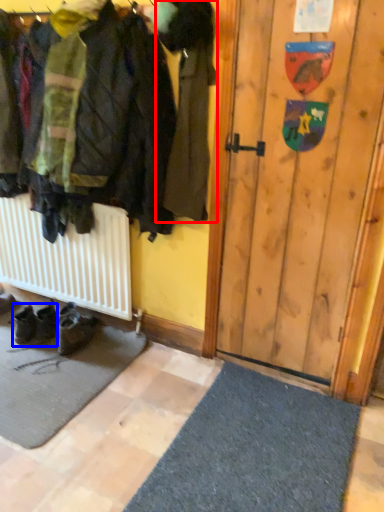
Question: Which object is further to the camera taking this photo, jacket (highlighted by a red box) or footwear (highlighted by a blue box)?

Choices:
 (A) jacket
 (B) footwear

Answer: (B)